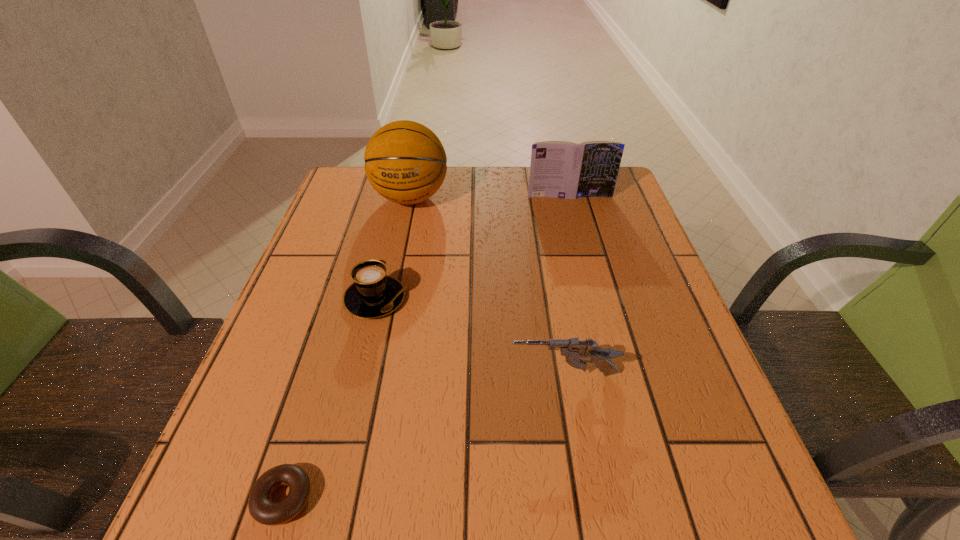
Locate an element on the screen. basketball is located at coordinates tap(405, 162).

This screenshot has width=960, height=540. I want to click on the fourth shortest object, so click(560, 169).

The width and height of the screenshot is (960, 540). What are the coordinates of `gun` in the screenshot? It's located at (574, 350).

The height and width of the screenshot is (540, 960). What are the coordinates of `the second nearest object` in the screenshot? It's located at (574, 350).

You are a GUI agent. You are given a task and a screenshot of the screen. Output one action in this format:
    pyautogui.click(x=<x>, y=<y>)
    Task: Click on the fourth tallest object
    
    Given the screenshot: What is the action you would take?
    pyautogui.click(x=373, y=294)

Locate an element on the screen. the third farthest object is located at coordinates (x=373, y=294).

Find the location of a particular element. This screenshot has height=540, width=960. the nearest object is located at coordinates (261, 507).

Find the location of a particular element. The width and height of the screenshot is (960, 540). doughnut is located at coordinates (261, 507).

Locate an element on the screen. free region located 0.100m on the surface of the basketball near the brand logo is located at coordinates (400, 245).

Where is `vacant point located on the front cover of the second tallest object`? Image resolution: width=960 pixels, height=540 pixels. vacant point located on the front cover of the second tallest object is located at coordinates (594, 288).